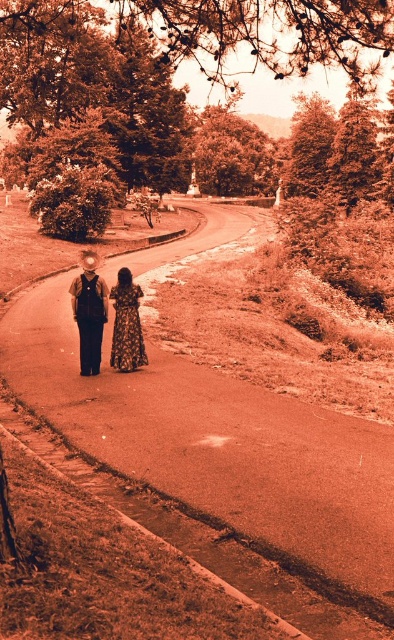
Question: Where is matte black dress at center located in relation to floral-patterned fabric dress at center in the image?

Choices:
 (A) below
 (B) above

Answer: (B)

Question: Estimate the real-world distances between objects in this image. Which object is closer to the smooth asphalt road at center?

Choices:
 (A) floral-patterned fabric dress at center
 (B) matte black dress at center

Answer: (A)

Question: Considering the real-world distances, which object is farthest from the matte black dress at center?

Choices:
 (A) smooth asphalt road at center
 (B) floral-patterned fabric dress at center

Answer: (A)

Question: Can you confirm if smooth asphalt road at center is thinner than matte black dress at center?

Choices:
 (A) yes
 (B) no

Answer: (B)

Question: Which point is closer to the camera?

Choices:
 (A) floral-patterned fabric dress at center
 (B) matte black dress at center

Answer: (B)

Question: Can you confirm if smooth asphalt road at center is wider than matte black dress at center?

Choices:
 (A) yes
 (B) no

Answer: (A)